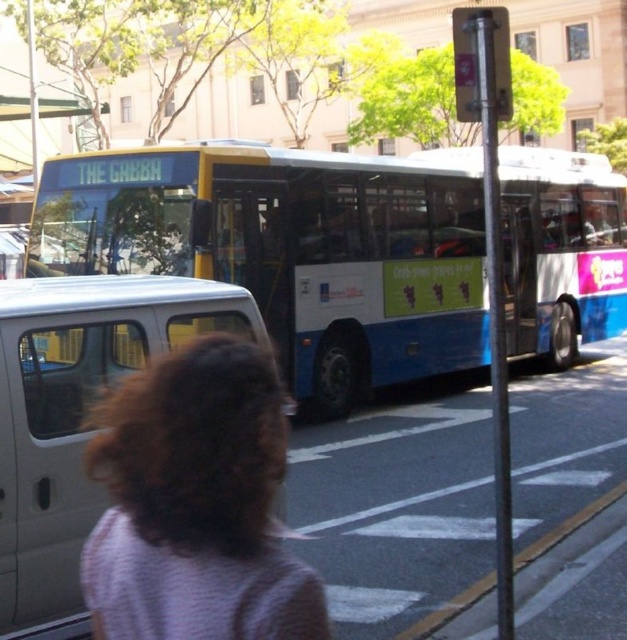
Question: Considering the relative positions of blue matte bus at center and white matte van at left in the image provided, where is blue matte bus at center located with respect to white matte van at left?

Choices:
 (A) left
 (B) right

Answer: (B)

Question: Does blue matte bus at center have a greater width compared to white matte van at left?

Choices:
 (A) yes
 (B) no

Answer: (A)

Question: Which point is farther to the camera?

Choices:
 (A) (3, 401)
 (B) (119, 211)

Answer: (B)

Question: Can you confirm if blue matte bus at center is positioned to the right of white matte van at left?

Choices:
 (A) no
 (B) yes

Answer: (B)

Question: Which point is farther to the camera?

Choices:
 (A) blue matte bus at center
 (B) white matte van at left

Answer: (A)